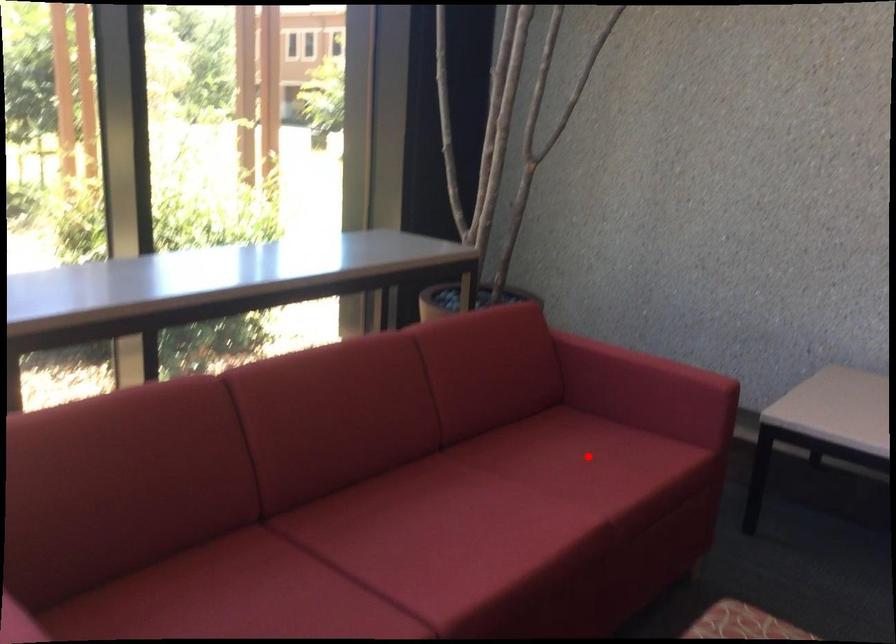
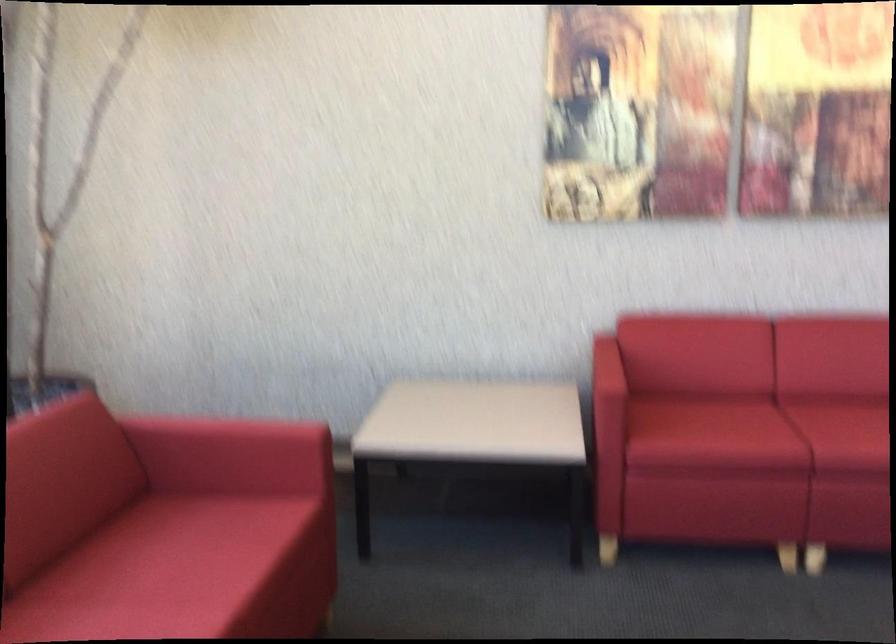
Locate, in the second image, the point that corresponds to the highlighted location in the first image.

(195, 547)